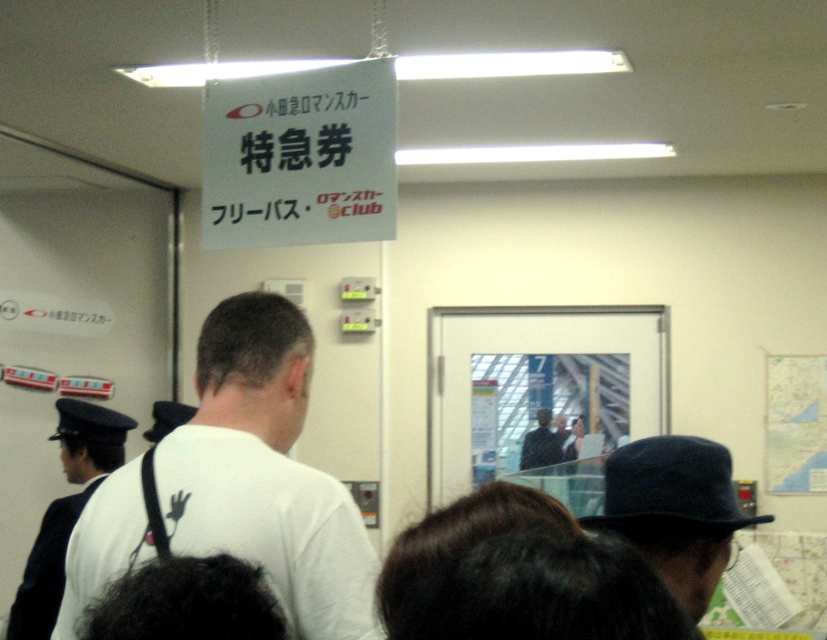
Between white paper sign at upper center and dark blue hat at center, which one has more height?

Standing taller between the two is white paper sign at upper center.

What do you see at coordinates (300, 157) in the screenshot?
I see `white paper sign at upper center` at bounding box center [300, 157].

Image resolution: width=827 pixels, height=640 pixels. Identify the location of white paper sign at upper center. (300, 157).

Does map paper at upper right have a greater width compared to dark blue hat at center?

Yes.

Does point (818, 483) lie behind point (541, 432)?

No, (818, 483) is closer to viewer.

Where is `map paper at upper right`? map paper at upper right is located at coordinates (796, 422).

Consider the image. Does white paper sign at upper center have a greater height compared to dark blue felt hat at center?

Yes, white paper sign at upper center is taller than dark blue felt hat at center.

Is white paper sign at upper center shorter than dark blue felt hat at center?

No.

Describe the element at coordinates (300, 157) in the screenshot. I see `white paper sign at upper center` at that location.

This screenshot has height=640, width=827. Find the location of `white paper sign at upper center`. white paper sign at upper center is located at coordinates 300,157.